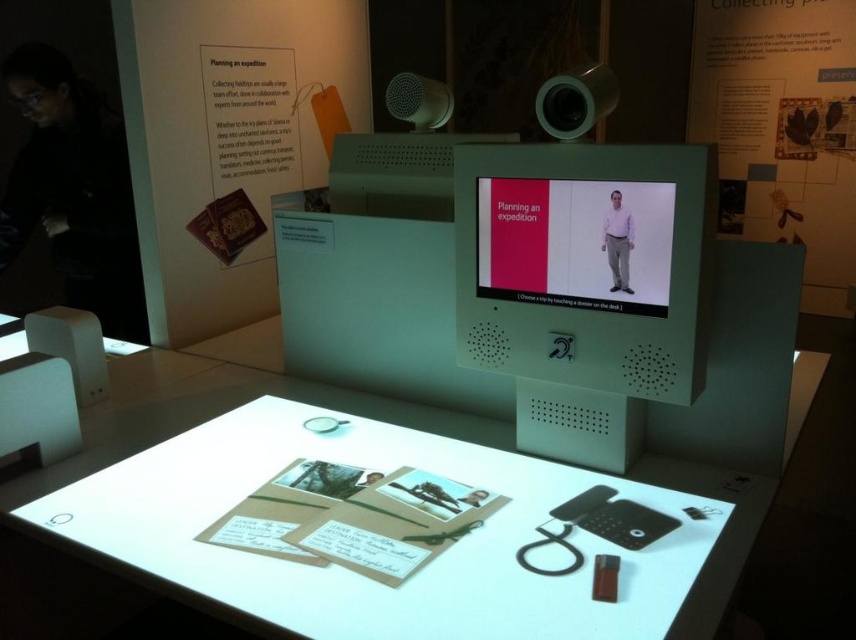
Question: Considering the relative positions of black fabric at left and matte plastic screen at center in the image provided, where is black fabric at left located with respect to matte plastic screen at center?

Choices:
 (A) above
 (B) below

Answer: (A)

Question: Which object is farther from the camera taking this photo?

Choices:
 (A) matte plastic screen at center
 (B) matte plastic monitor at center
 (C) black fabric at left

Answer: (C)

Question: Does matte plastic monitor at center appear over white glossy table at center?

Choices:
 (A) yes
 (B) no

Answer: (A)

Question: Which point is farther to the camera?

Choices:
 (A) matte plastic monitor at center
 (B) black fabric at left

Answer: (B)

Question: Which point is farther from the camera taking this photo?

Choices:
 (A) (593, 278)
 (B) (158, 420)

Answer: (B)

Question: Is white glossy table at center closer to the viewer compared to black fabric at left?

Choices:
 (A) no
 (B) yes

Answer: (B)